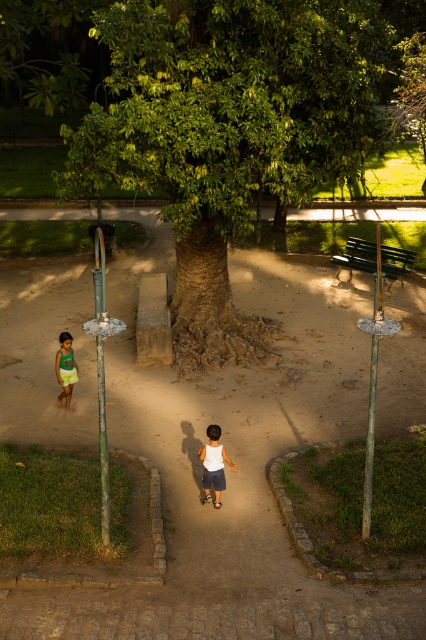
You are standing in the park and want to reach the point marked as point (181, 10). If you walk straight ahead, will you reach it before walking 25 meters?

Yes, because the point (181, 10) is only 22.09 meters away from the viewer, which is less than 25 meters.

You are standing at the point labeled as point (230, 472) in the park scene. What type of terrain are you currently standing on?

The point (230, 472) is on brown dirt path at center, so you are standing on a dirt path.

You are standing at the entrance of the park and see the brown dirt path at center. Based on its 2D coordinates, can you determine if it leads towards the tree or away from it?

The brown dirt path at center is located at point (230, 472), which suggests it is positioned towards the center of the image. Since the tree is the focal point dominating the center, the path likely leads towards the tree.